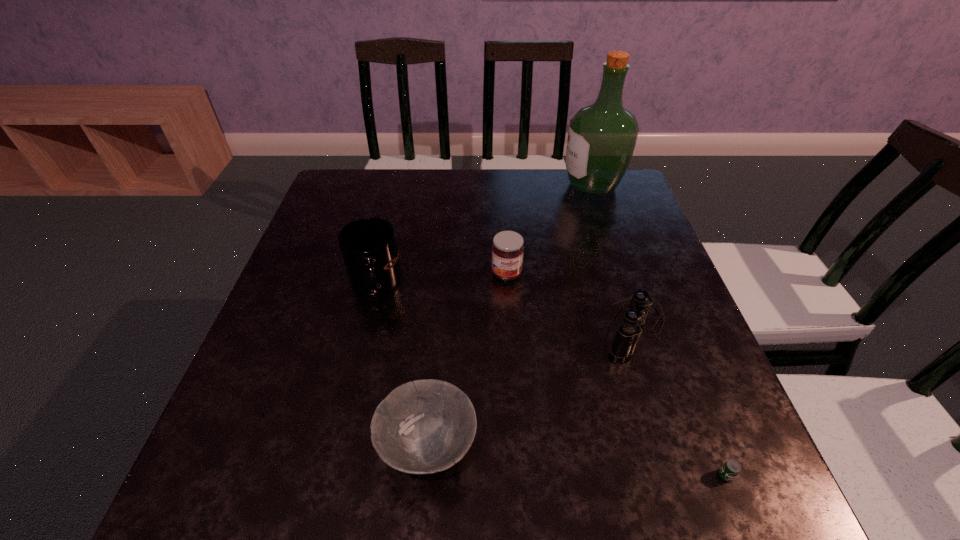
At what (x,y) coordinates should I click in order to perform the action: click on object located in the left edge section of the desktop. Please return your answer as a coordinate pair (x, y). This screenshot has height=540, width=960. Looking at the image, I should click on (368, 246).

Find the location of `liquor that is at the right edge`. liquor that is at the right edge is located at coordinates (601, 139).

Where is `binoculars that is at the right edge`? This screenshot has height=540, width=960. binoculars that is at the right edge is located at coordinates (628, 333).

Find the location of a particular element. Image resolution: width=960 pixels, height=540 pixels. beer can positioned at the right edge is located at coordinates (731, 468).

What are the coordinates of `object that is positioned at the far right corner` in the screenshot? It's located at (601, 139).

Find the location of `object that is at the near right corner`. object that is at the near right corner is located at coordinates click(731, 468).

Identify the location of free space at the far edge. Image resolution: width=960 pixels, height=540 pixels. (567, 211).

Locate an element on the screen. The height and width of the screenshot is (540, 960). vacant space at the left edge is located at coordinates (307, 329).

This screenshot has height=540, width=960. In the image, there is a desktop. Identify the location of vacant space at the right edge. (644, 245).

The image size is (960, 540). I want to click on vacant area that lies between the binoculars and the tallest object, so click(x=613, y=256).